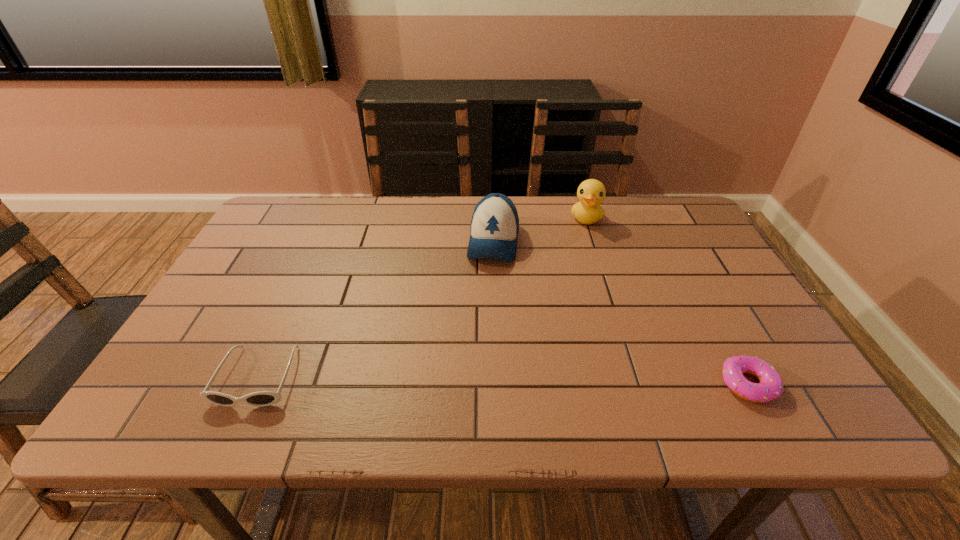
Where is `vacant region that satisfies the following two spatial constraints: 1. with the lenses of the third tallest object facing outward; 2. on the left side of the doughnut`? The height and width of the screenshot is (540, 960). vacant region that satisfies the following two spatial constraints: 1. with the lenses of the third tallest object facing outward; 2. on the left side of the doughnut is located at coordinates (254, 384).

Identify the location of vacant area that satisfies the following two spatial constraints: 1. with the lenses of the third tallest object facing outward; 2. on the left side of the shortest object. The height and width of the screenshot is (540, 960). click(x=254, y=384).